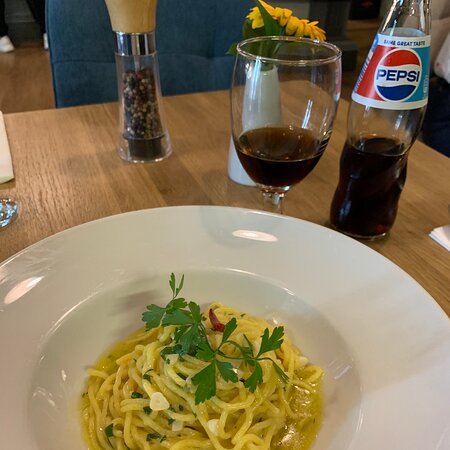
Locate an element on the screen. 1 round plate is located at coordinates (117, 260).